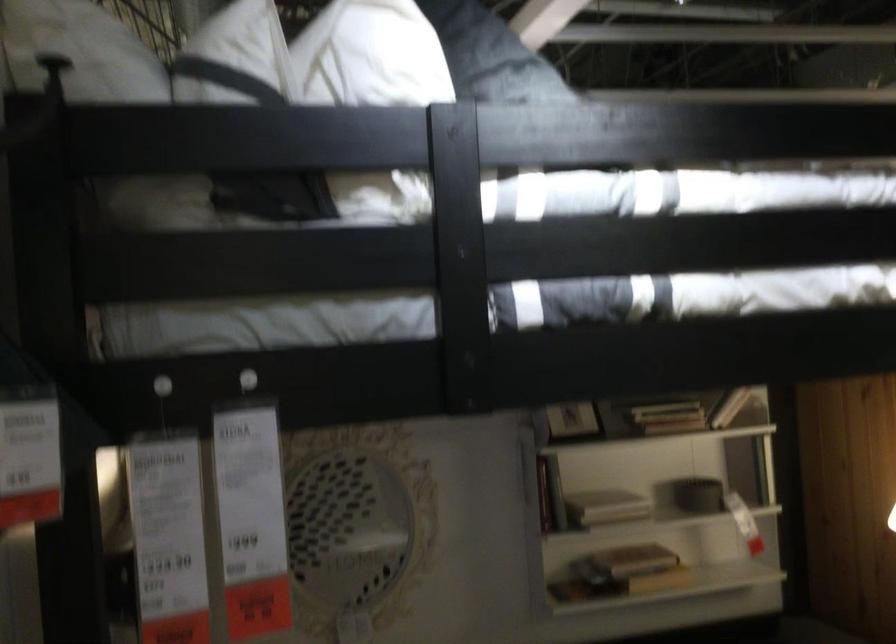
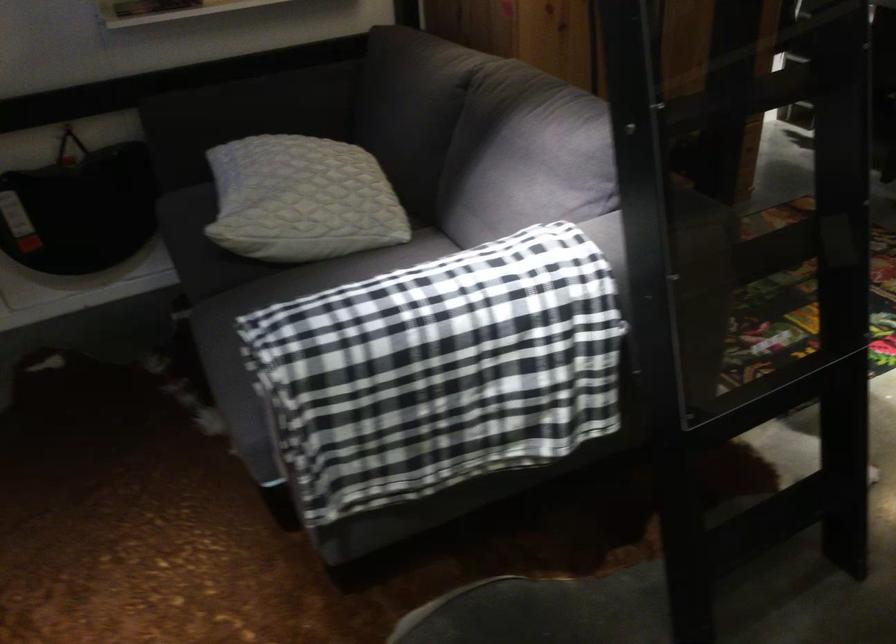
The first image is from the beginning of the video and the second image is from the end. How did the camera likely rotate when shooting the video?

The camera's rotation is toward right-down.